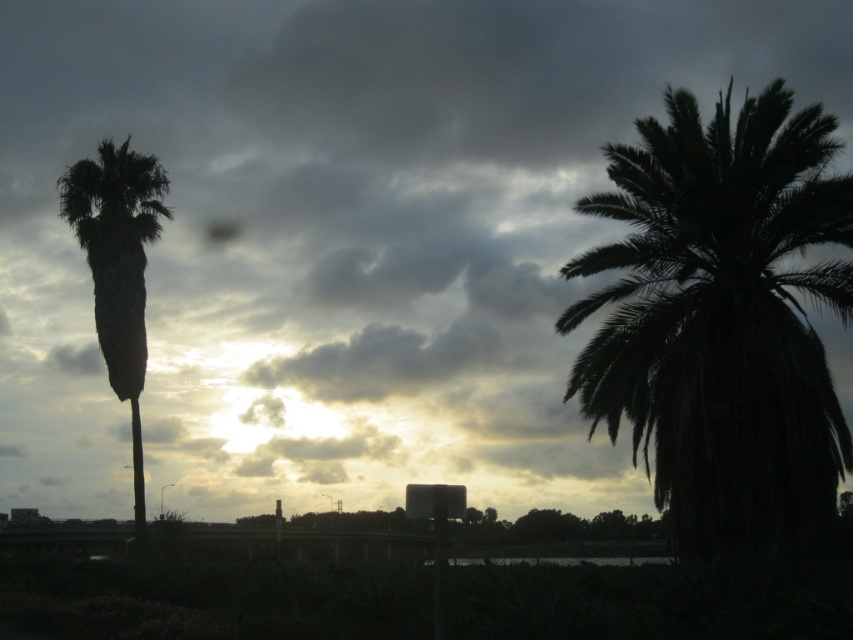
Is dark green leafy palm at right closer to the viewer compared to green leafy palm at left?

That is True.

What do you see at coordinates (721, 317) in the screenshot? The height and width of the screenshot is (640, 853). I see `dark green leafy palm at right` at bounding box center [721, 317].

Which is behind, point (848, 301) or point (128, 397)?

Positioned behind is point (128, 397).

Image resolution: width=853 pixels, height=640 pixels. What are the coordinates of `dark green leafy palm at right` in the screenshot? It's located at (721, 317).